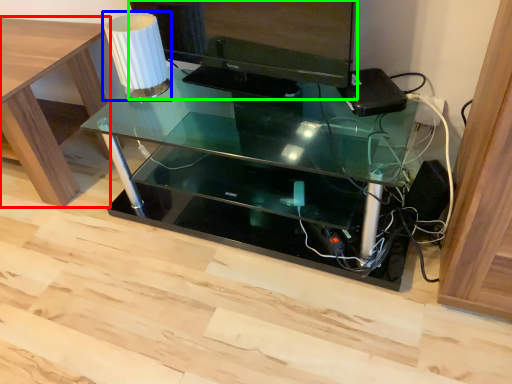
Question: Which object is positioned closest to table (highlighted by a red box)? Select from table lamp (highlighted by a blue box) and computer monitor (highlighted by a green box).

Choices:
 (A) table lamp
 (B) computer monitor

Answer: (A)